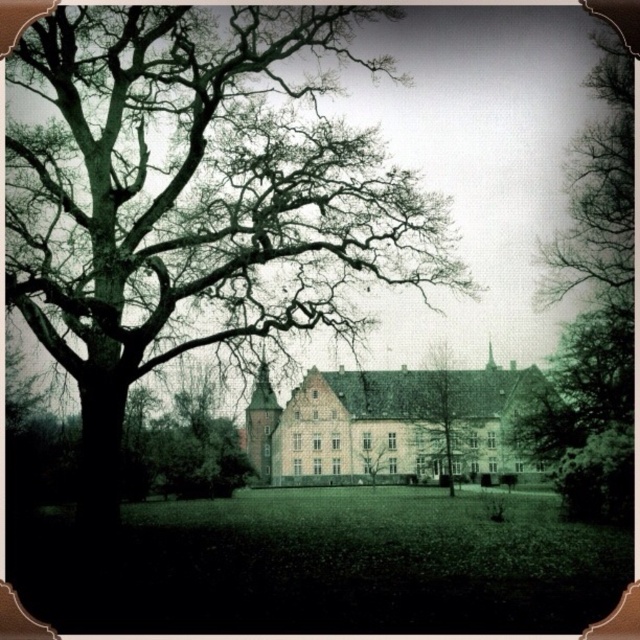
You are standing in front of the historic building and want to take a photo that includes both the green leafy tree at right and the smooth bark tree at center. Which tree should you position closer to the camera to ensure both are in focus?

To ensure both the green leafy tree at right and the smooth bark tree at center are in focus, position the green leafy tree at right closer to the camera since it is already nearer to the viewer compared to the smooth bark tree at center.

You are standing in front of the white smooth building at center and want to take a photo of it without the dark green textured tree at left blocking the view. Which direction should you move to ensure the tree is out of the frame?

The dark green textured tree at left is to the left of the white smooth building at center. To avoid the tree blocking the view, you should move to the right side of the building.

You are an architect planning to install a new pathway between the dark green textured tree at left and the smooth bark tree at center. Based on their widths, which tree would require more space on either side of the pathway?

The dark green textured tree at left might be wider than the smooth bark tree at center, so it would require more space on either side of the pathway.